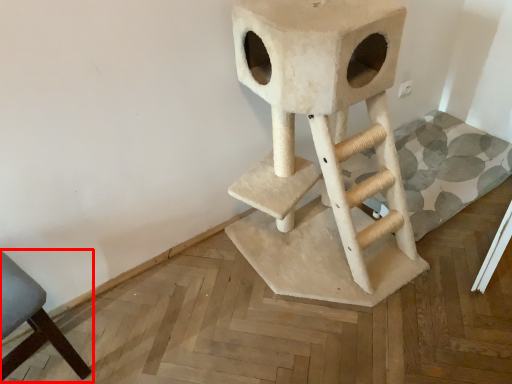
Question: From the image's perspective, considering the relative positions of chair (annotated by the red box) and bar stool in the image provided, where is chair (annotated by the red box) located with respect to the staircase?

Choices:
 (A) above
 (B) below

Answer: (B)